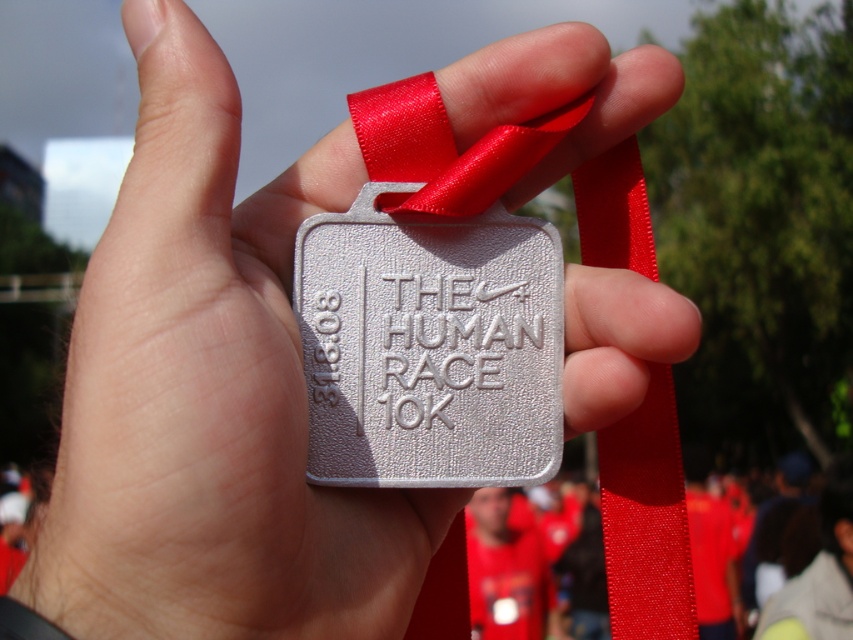
Question: Which of the following is the closest to the observer?

Choices:
 (A) (432, 381)
 (B) (433, 141)

Answer: (A)

Question: Can you confirm if silver textured medal at center is positioned below red satin ribbon at center?

Choices:
 (A) no
 (B) yes

Answer: (A)

Question: Among these objects, which one is farthest from the camera?

Choices:
 (A) silver textured medal at center
 (B) red satin ribbon at center

Answer: (A)

Question: Observing the image, what is the correct spatial positioning of silver textured medal at center in reference to red satin ribbon at center?

Choices:
 (A) left
 (B) right

Answer: (A)

Question: Observing the image, what is the correct spatial positioning of silver textured medal at center in reference to red satin ribbon at center?

Choices:
 (A) above
 (B) below

Answer: (A)

Question: Among these points, which one is farthest from the camera?

Choices:
 (A) pos(496,196)
 (B) pos(363,284)

Answer: (B)